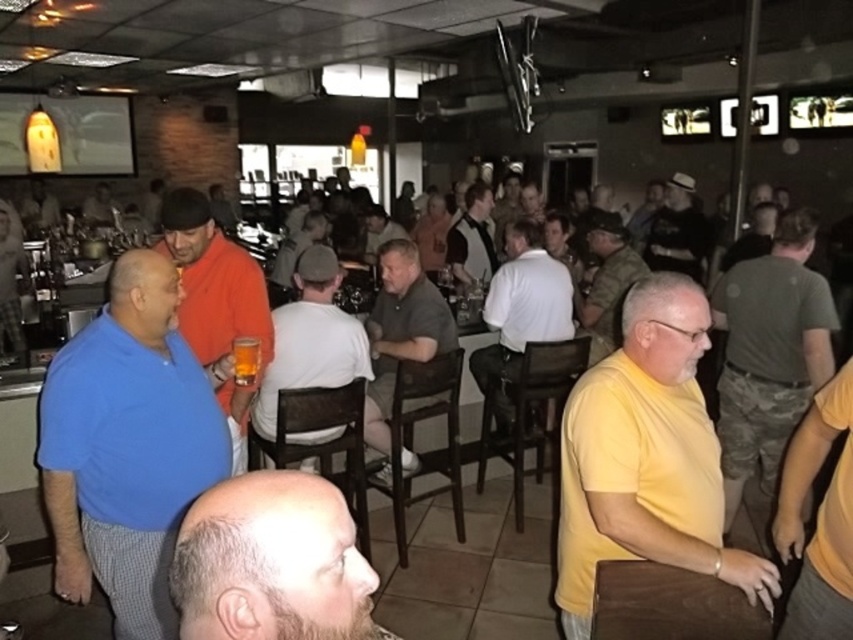
Question: Which object appears farthest from the camera in this image?

Choices:
 (A) bald head at center
 (B) camouflage pants at right
 (C) yellow matte shirt at right

Answer: (B)

Question: Considering the real-world distances, which object is farthest from the camouflage pants at right?

Choices:
 (A) dark gray hat at upper right
 (B) white cotton shirt at center
 (C) white jersey at center

Answer: (A)

Question: Is yellow matte shirt at right further to the viewer compared to white cotton shirt at center?

Choices:
 (A) no
 (B) yes

Answer: (A)

Question: Is yellow matte shirt at center behind white cotton shirt at center?

Choices:
 (A) no
 (B) yes

Answer: (A)

Question: Which of the following is the closest to the observer?

Choices:
 (A) orange matte shirt at center
 (B) orange shirt at center

Answer: (A)

Question: In this image, where is dark gray hat at upper right located relative to orange shirt at center?

Choices:
 (A) left
 (B) right

Answer: (B)